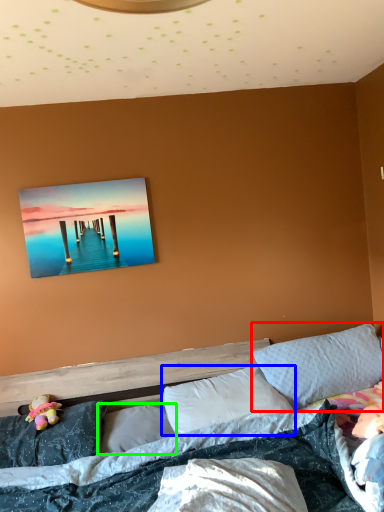
Question: Which is farther away from pillow (highlighted by a red box)? pillow (highlighted by a blue box) or pillow (highlighted by a green box)?

Choices:
 (A) pillow
 (B) pillow

Answer: (B)